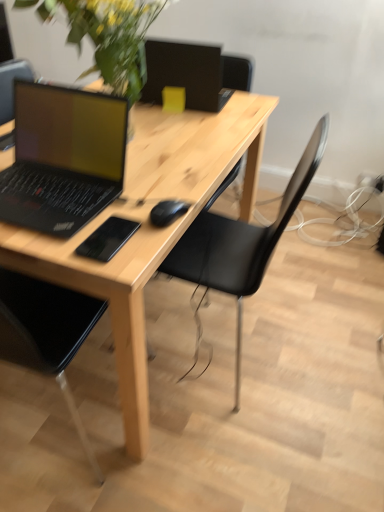
Locate an element on the screen. vacant space in between black matte mouse at center and black matte mousepad at center is located at coordinates (143, 230).